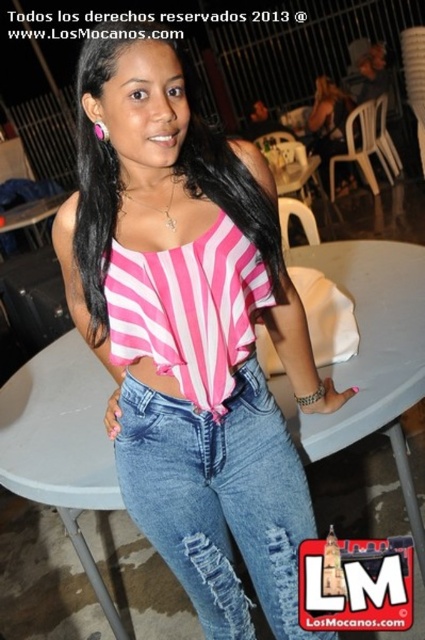
You are a photographer adjusting your camera settings to capture the woman in the image. The pink striped fabric top at center is your main subject. If your camera focuses on the point at coordinates point (189, 333), will it successfully focus on the pink striped fabric top at center?

Yes, the point (189, 333) indicates the pink striped fabric top at center, so focusing there will successfully capture the main subject.

You are a fashion designer observing a model wearing the pink striped fabric at center and denim jeans at center. From the model facing forward, which item is positioned to the left?

The pink striped fabric at center is positioned to the left of denim jeans at center.

You are a photographer trying to capture a detailed closeup of the pink striped fabric at center. Based on the scene, what is the minimum distance you need to be from the fabric to get a clear shot?

The minimum distance you need to be from the pink striped fabric at center is 89.15 centimeters to ensure a clear shot, as that is the distance between the fabric and the camera.